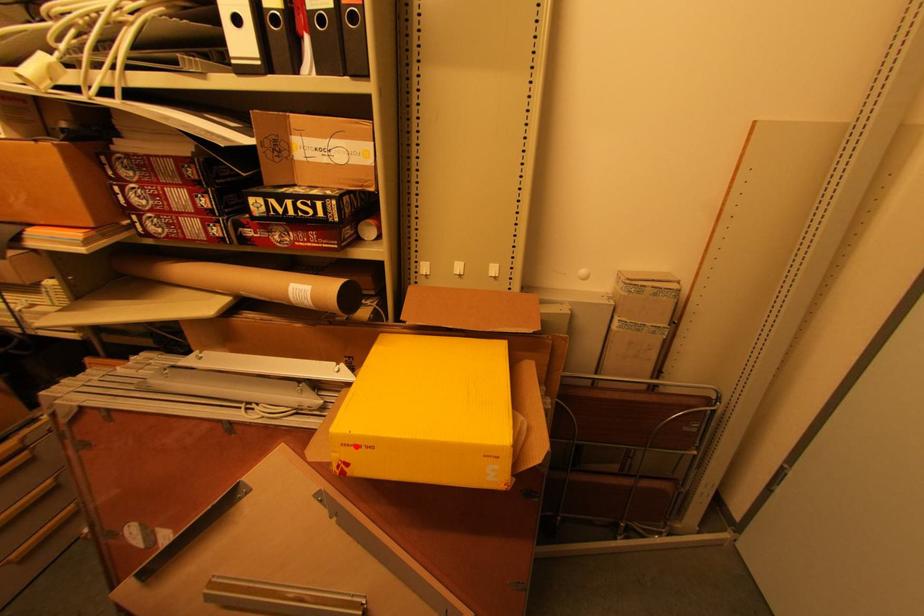
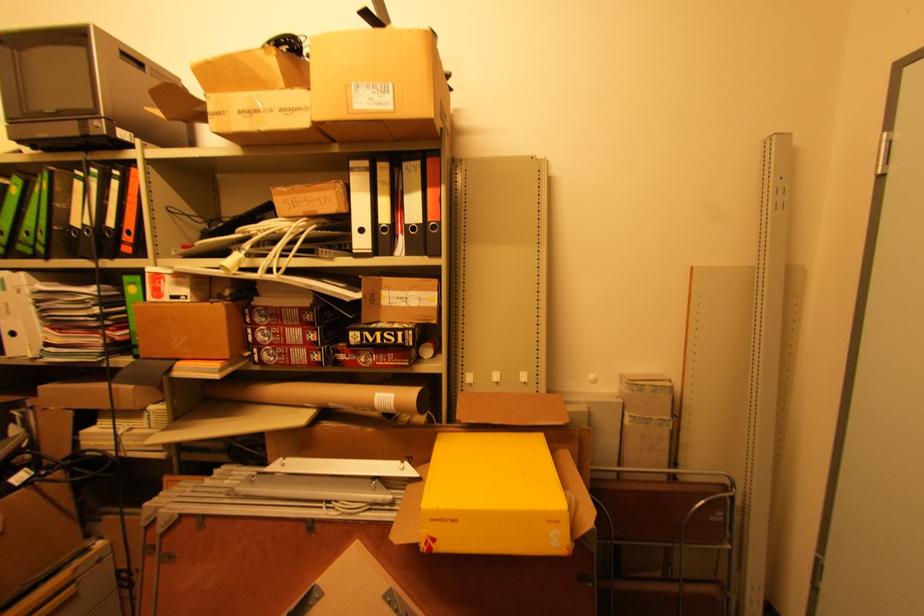
Where in the second image is the point corresponding to the highlighted location from the first image?

(444, 521)